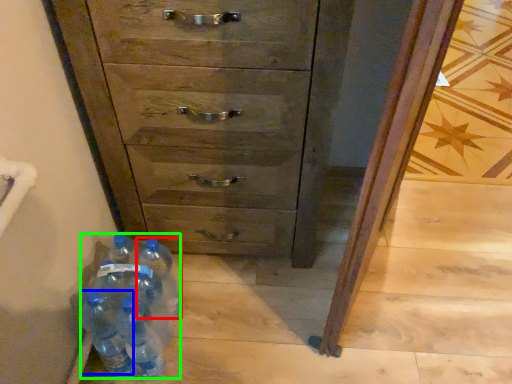
Question: Which object is the farthest from bottle (highlighted by a red box)? Choose among these: bottle (highlighted by a blue box) or bottle (highlighted by a green box).

Choices:
 (A) bottle
 (B) bottle

Answer: (A)